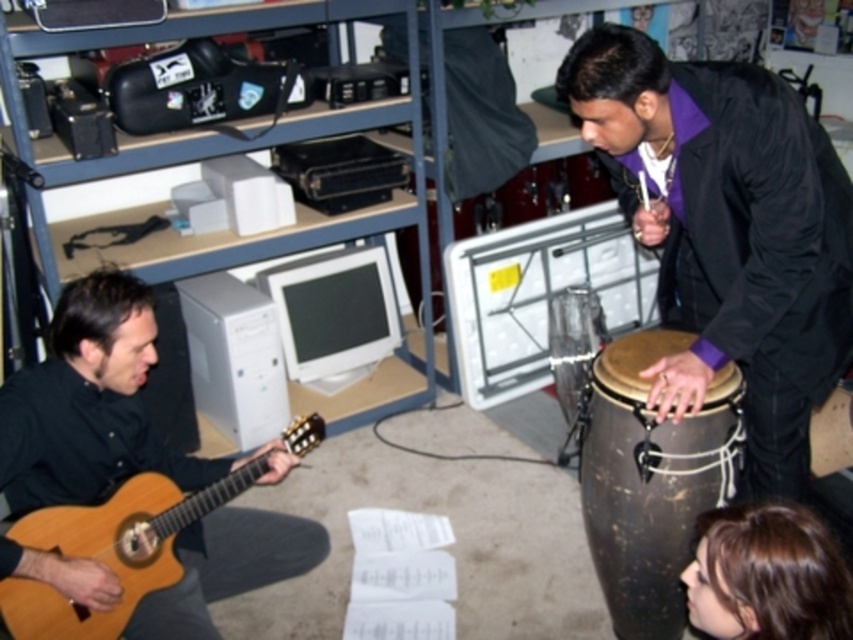
Can you confirm if brown leather drum at lower center is positioned to the right of white glossy monitor at center?

Indeed, brown leather drum at lower center is positioned on the right side of white glossy monitor at center.

Does brown leather drum at lower center appear over white glossy monitor at center?

Actually, brown leather drum at lower center is below white glossy monitor at center.

What are the coordinates of `brown leather drum at lower center` in the screenshot? It's located at (650, 480).

Locate an element on the screen. The height and width of the screenshot is (640, 853). brown leather drum at lower center is located at coordinates (650, 480).

Does brown leather drum at lower center have a greater height compared to light brown wooden guitar at lower left?

Yes.

Which of these two, brown leather drum at lower center or light brown wooden guitar at lower left, stands shorter?

light brown wooden guitar at lower left is shorter.

Identify the location of brown leather drum at lower center. (650, 480).

Locate an element on the screen. The image size is (853, 640). brown leather drum at lower center is located at coordinates (650, 480).

Who is taller, shiny black jacket at right or white glossy monitor at center?

shiny black jacket at right

Is point (637, 45) positioned after point (293, 301)?

That is False.

Find the location of `shiny black jacket at right`. shiny black jacket at right is located at coordinates [728, 230].